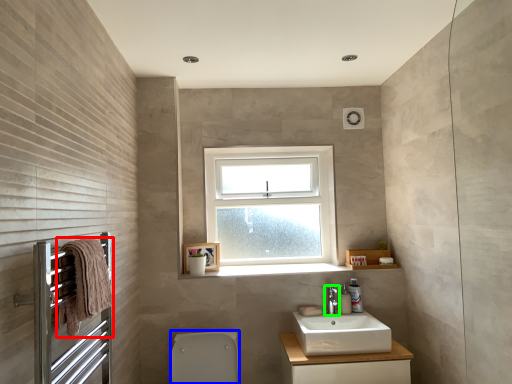
Question: Based on their relative distances, which object is nearer to material (highlighted by a red box)? Choose from toilet bowl (highlighted by a blue box) and tap (highlighted by a green box).

Choices:
 (A) toilet bowl
 (B) tap

Answer: (A)